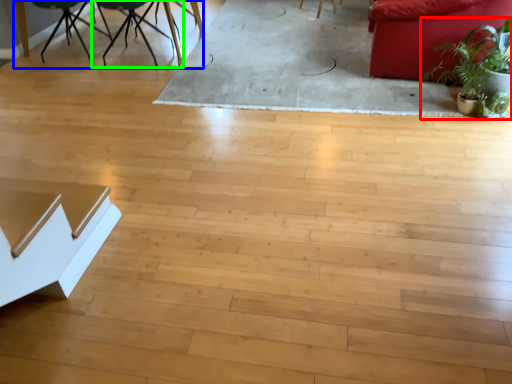
Question: Based on their relative distances, which object is farther from houseplant (highlighted by a red box)? Choose from round table (highlighted by a blue box) and chair (highlighted by a green box).

Choices:
 (A) round table
 (B) chair

Answer: (A)